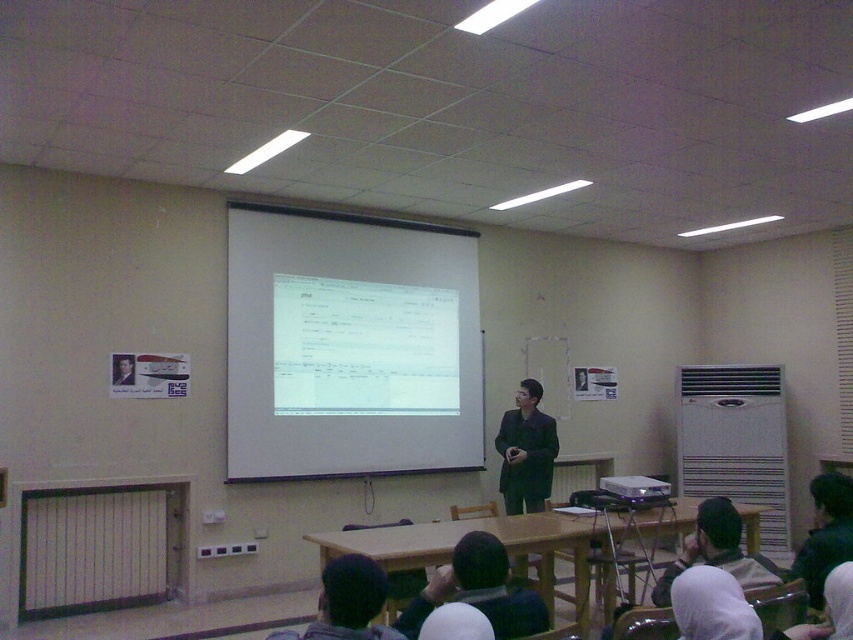
Question: Is white matte projection screen at center below matte black projector at center?

Choices:
 (A) no
 (B) yes

Answer: (A)

Question: Which point is closer to the camera taking this photo?

Choices:
 (A) (599, 484)
 (B) (521, 452)
 (C) (291, 355)

Answer: (B)

Question: Which object is positioned farthest from the dark matte suit at center?

Choices:
 (A) white matte projection screen at center
 (B) matte black projector at center

Answer: (B)

Question: Does white matte projection screen at center appear over dark matte suit at center?

Choices:
 (A) yes
 (B) no

Answer: (A)

Question: Among these points, which one is farthest from the camera?

Choices:
 (A) [305, 339]
 (B) [659, 493]

Answer: (A)

Question: Considering the relative positions of dark matte suit at center and matte black projector at center in the image provided, where is dark matte suit at center located with respect to matte black projector at center?

Choices:
 (A) right
 (B) left

Answer: (B)